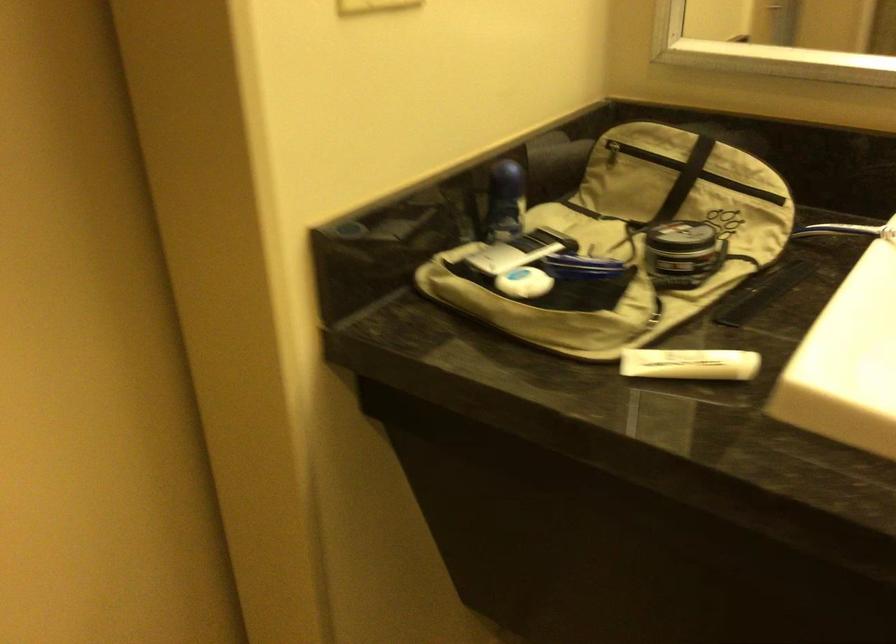
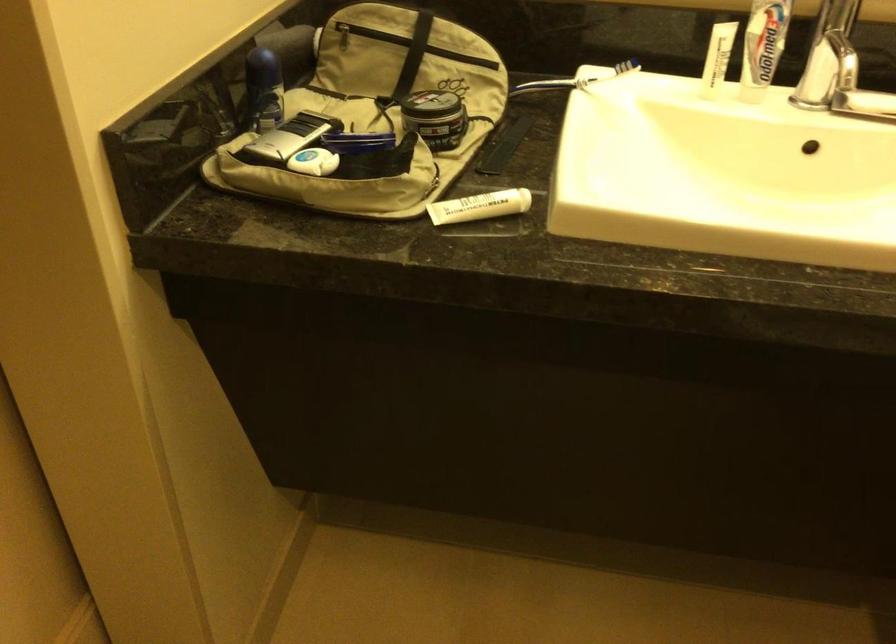
Where in the second image is the point corresponding to (x=512, y=250) from the first image?

(288, 137)